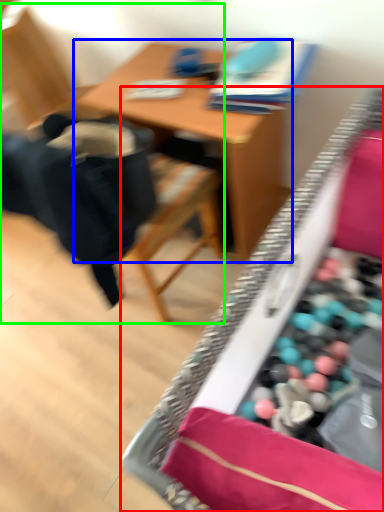
Question: Which object is the closest to the desk (highlighted by a red box)? Choose among these: table (highlighted by a blue box) or chair (highlighted by a green box).

Choices:
 (A) table
 (B) chair

Answer: (A)